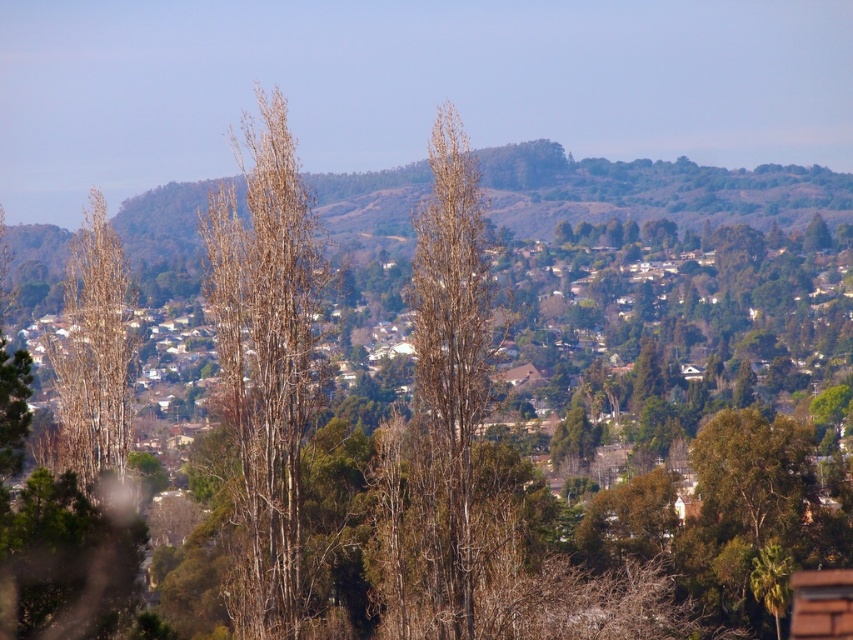
Consider the image. Which is above, brown/dry wood tree at center or bare wood tree at center?

Positioned higher is brown/dry wood tree at center.

What do you see at coordinates (265, 356) in the screenshot? The height and width of the screenshot is (640, 853). I see `brown/dry wood tree at center` at bounding box center [265, 356].

Locate an element on the screen. The image size is (853, 640). brown/dry wood tree at center is located at coordinates (265, 356).

Between brown/dry wood tree at center and brown textured tree at left, which one has more height?

With more height is brown/dry wood tree at center.

Which of these two, brown/dry wood tree at center or brown textured tree at left, stands shorter?

brown textured tree at left is shorter.

Where is `brown/dry wood tree at center`? This screenshot has width=853, height=640. brown/dry wood tree at center is located at coordinates (265, 356).

Identify the location of brown/dry wood tree at center. (265, 356).

Based on the photo, is bare wood tree at center below brown textured tree at left?

Incorrect, bare wood tree at center is not positioned below brown textured tree at left.

Which is more to the right, bare wood tree at center or brown textured tree at left?

From the viewer's perspective, bare wood tree at center appears more on the right side.

This screenshot has width=853, height=640. What do you see at coordinates (450, 372) in the screenshot?
I see `bare wood tree at center` at bounding box center [450, 372].

You are a GUI agent. You are given a task and a screenshot of the screen. Output one action in this format:
    pyautogui.click(x=<x>, y=<y>)
    Task: Click on the bare wood tree at center
    
    Given the screenshot: What is the action you would take?
    pyautogui.click(x=450, y=372)